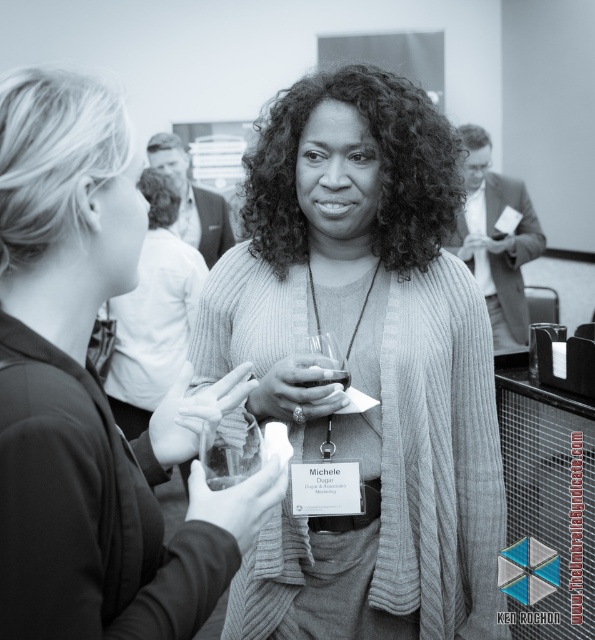
Question: Which point is closer to the camera taking this photo?

Choices:
 (A) [330, 346]
 (B) [346, 384]

Answer: (A)

Question: Does woolen cardigan at center have a smaller size compared to clear glass wine glass at center?

Choices:
 (A) yes
 (B) no

Answer: (B)

Question: Is knitted sweater at center above transparent glass at center?

Choices:
 (A) no
 (B) yes

Answer: (B)

Question: Which point appears farthest from the camera in this image?

Choices:
 (A) (230, 273)
 (B) (346, 380)
 (C) (305, 445)
 (D) (64, 628)

Answer: (A)

Question: Which point appears closest to the camera in this image?

Choices:
 (A) (333, 355)
 (B) (399, 211)

Answer: (A)

Question: Is knitted sweater at center further to the viewer compared to translucent glass wine at center?

Choices:
 (A) yes
 (B) no

Answer: (B)